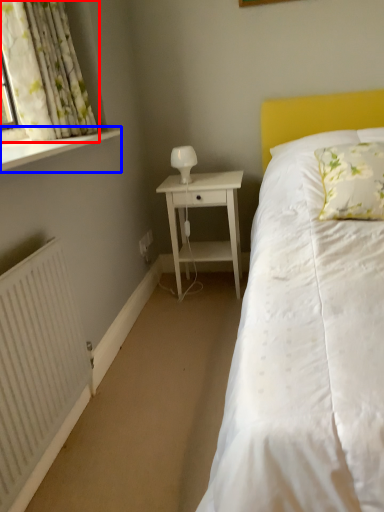
Question: Which point is closer to the camera, curtain (highlighted by a red box) or window sill (highlighted by a blue box)?

Choices:
 (A) curtain
 (B) window sill

Answer: (B)